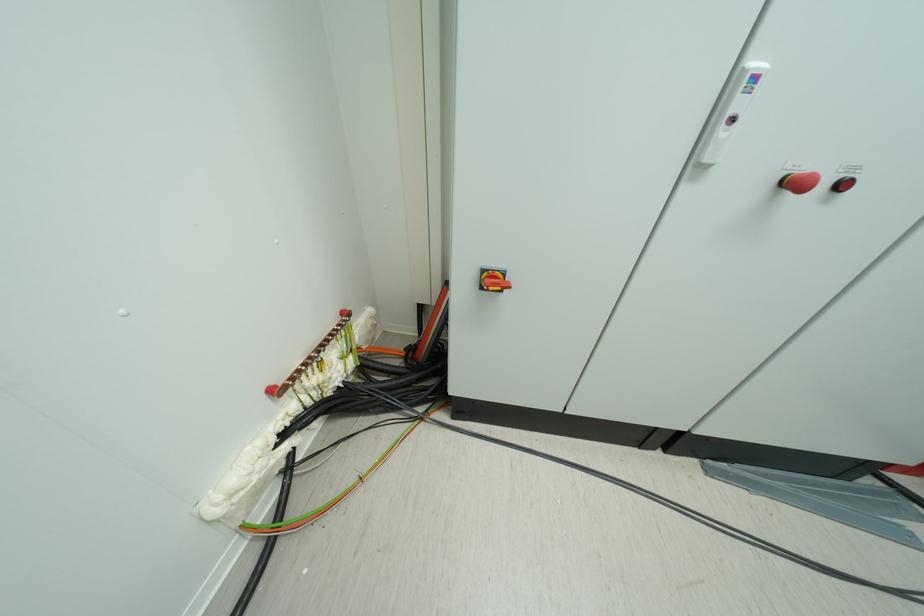
Where would you push the black push button? Please return your answer as a coordinate pair (x, y).

(843, 184)